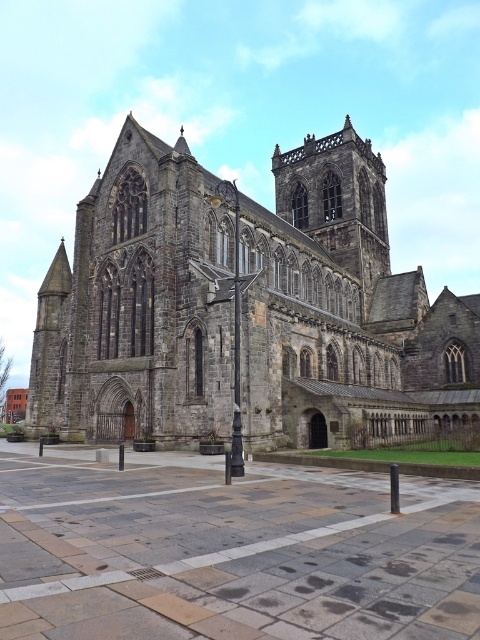
You are standing in front of the Gothic church and notice two specific points marked on the facade. The first point is at coordinates point (307,333) and the second is at point (235,317). Which of these two points is closer to your current position?

Point (235,317) is closer to your current position because it is less further to the camera than point (307,333).

A drone is flying at point A located at coordinates point A at (x=327, y=349). It needs to reach point B, which is 81.03 meters away. Given the church structure described, is there a direct flight path between these points without colliding with any part of the church?

The points are 81.03 meters apart, but the church structure includes a central tower with a spire and steeply pitched roofs. The drone may need to navigate around these structures to avoid collision, so a direct path might not be feasible.

Based on the scene description, what is located at the coordinates point (343, 310)?

The dark gray stone church at center is located at point (343, 310).